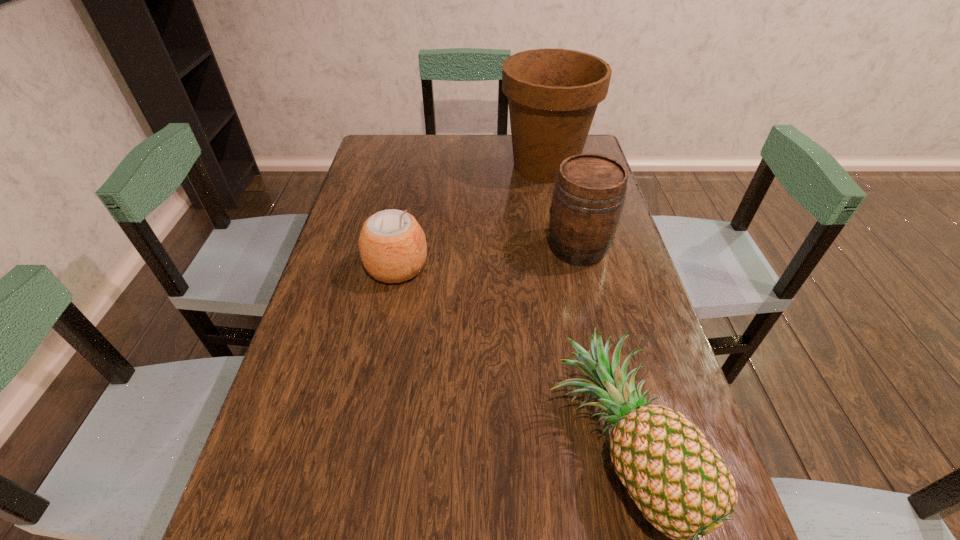
Where is `object that ranks as the second closest to the pineapple`? This screenshot has width=960, height=540. object that ranks as the second closest to the pineapple is located at coordinates (392, 245).

Image resolution: width=960 pixels, height=540 pixels. I want to click on object that is the third closest one to the leftmost object, so click(x=680, y=483).

Identify the location of vacant space that satisfies the following two spatial constraints: 1. on the side of the cider near the bung hole; 2. on the front side of the coconut. [583, 267].